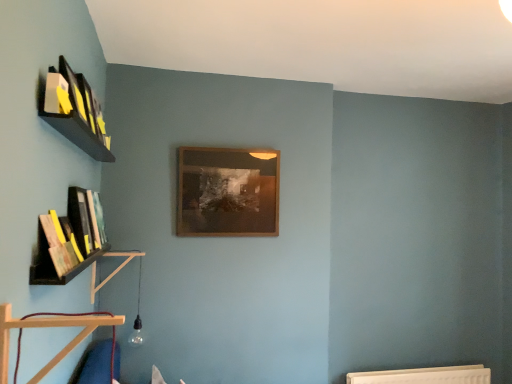
Where is `wooden picture frame at center`? The width and height of the screenshot is (512, 384). wooden picture frame at center is located at coordinates (228, 192).

This screenshot has height=384, width=512. In order to click on wooden at lower left, which is counted as the 2th shelf, starting from the back in this screenshot , I will do `click(47, 326)`.

What is the approximate width of hardcover book at left, acting as the 2th book starting from the back?

hardcover book at left, acting as the 2th book starting from the back, is 8.23 centimeters wide.

This screenshot has width=512, height=384. Find the location of `wooden picture frame at center`. wooden picture frame at center is located at coordinates (228, 192).

Based on the photo, is wooden at left, the first shelf in the back-to-front sequence, further to camera compared to matte yellow book at upper left, the third book in the left-to-right sequence?

Yes, the depth of wooden at left, the first shelf in the back-to-front sequence, is greater than that of matte yellow book at upper left, the third book in the left-to-right sequence.

Find the location of a particular element. Image resolution: width=512 pixels, height=384 pixels. book that is the 3rd one above the wooden at left, the second shelf in the right-to-left sequence (from a real-world perspective) is located at coordinates (57, 95).

In terms of size, does wooden at left, arranged as the second shelf when viewed from the front, appear bigger or smaller than matte yellow book at upper left, which is the third book from back to front?

wooden at left, arranged as the second shelf when viewed from the front, is bigger than matte yellow book at upper left, which is the third book from back to front.

Consider the image. Measure the distance between wooden at left, arranged as the first shelf when viewed from the left, and matte yellow book at upper left, placed as the 3th book when sorted from bottom to top.

wooden at left, arranged as the first shelf when viewed from the left, is 1.21 meters from matte yellow book at upper left, placed as the 3th book when sorted from bottom to top.

Is wooden picture frame at center far from wooden at lower left, the 2th shelf positioned from the left?

Yes, wooden picture frame at center is far from wooden at lower left, the 2th shelf positioned from the left.

I want to click on the 1st shelf below the wooden picture frame at center (from the image's perspective), so click(47, 326).

In terms of height, does wooden picture frame at center look taller or shorter compared to wooden at lower left, the 2th shelf positioned from the left?

wooden picture frame at center is taller than wooden at lower left, the 2th shelf positioned from the left.

Considering the positions of points (213, 221) and (16, 319), is point (213, 221) farther from camera compared to point (16, 319)?

Yes, point (213, 221) is farther from viewer.

From a real-world perspective, is hardcover book at left, the second book from the top, beneath wooden at left, arranged as the first shelf when viewed from the left?

No, from a real-world perspective, hardcover book at left, the second book from the top, is not under wooden at left, arranged as the first shelf when viewed from the left.

From the image's perspective, is hardcover book at left, acting as the 2th book starting from the back, located above wooden at left, the second shelf in the right-to-left sequence?

Yes, from the image's perspective, hardcover book at left, acting as the 2th book starting from the back, is on top of wooden at left, the second shelf in the right-to-left sequence.

Who is taller, hardcover book at left, the 2th book in the left-to-right sequence, or wooden at left, the second shelf in the right-to-left sequence?

With more height is wooden at left, the second shelf in the right-to-left sequence.

From a real-world perspective, who is located higher, wooden at lower left, acting as the first shelf starting from the front, or matte yellow book at upper left, which ranks as the first book in right-to-left order?

matte yellow book at upper left, which ranks as the first book in right-to-left order, from a real-world perspective.

Between wooden at lower left, acting as the first shelf starting from the front, and matte yellow book at upper left, placed as the first book when sorted from top to bottom, which one appears on the left side from the viewer's perspective?

From the viewer's perspective, matte yellow book at upper left, placed as the first book when sorted from top to bottom, appears more on the left side.

Between wooden at lower left, the 2th shelf positioned from the left, and matte yellow book at upper left, placed as the 3th book when sorted from bottom to top, which one is positioned behind?

Positioned behind is matte yellow book at upper left, placed as the 3th book when sorted from bottom to top.

Could you tell me if wooden at lower left, the 2th shelf positioned from the left, is turned towards matte yellow book at upper left, placed as the 3th book when sorted from bottom to top?

No, wooden at lower left, the 2th shelf positioned from the left, is not aimed at matte yellow book at upper left, placed as the 3th book when sorted from bottom to top.

Considering the relative sizes of hardcover book at left, which ranks as the first book in left-to-right order, and wooden at left, arranged as the first shelf when viewed from the left, in the image provided, is hardcover book at left, which ranks as the first book in left-to-right order, smaller than wooden at left, arranged as the first shelf when viewed from the left,?

Indeed, hardcover book at left, which ranks as the first book in left-to-right order, has a smaller size compared to wooden at left, arranged as the first shelf when viewed from the left.

Is hardcover book at left, arranged as the third book when viewed from the right, not within wooden at left, the first shelf in the back-to-front sequence?

hardcover book at left, arranged as the third book when viewed from the right, lies outside wooden at left, the first shelf in the back-to-front sequence,'s area.

Is hardcover book at left, which ranks as the first book in left-to-right order, in front of or behind wooden at left, the first shelf in the back-to-front sequence, in the image?

Visually, hardcover book at left, which ranks as the first book in left-to-right order, is located in front of wooden at left, the first shelf in the back-to-front sequence.

From the picture: Is hardcover book at left, which ranks as the first book in left-to-right order, thinner than wooden at left, the first shelf in the back-to-front sequence?

Correct, the width of hardcover book at left, which ranks as the first book in left-to-right order, is less than that of wooden at left, the first shelf in the back-to-front sequence.

Is matte yellow book at upper left, which is the third book from back to front, next to wooden picture frame at center and touching it?

No, matte yellow book at upper left, which is the third book from back to front, is not with wooden picture frame at center.

Which is in front, point (45, 98) or point (231, 150)?

The point (45, 98) is closer.

Is matte yellow book at upper left, which ranks as the first book in right-to-left order, facing away from wooden picture frame at center?

No, matte yellow book at upper left, which ranks as the first book in right-to-left order, is not facing away from wooden picture frame at center.

Between matte yellow book at upper left, placed as the first book when sorted from top to bottom, and wooden picture frame at center, which one has less height?

matte yellow book at upper left, placed as the first book when sorted from top to bottom.

From the image's perspective, which book is the 1st one below the matte yellow book at upper left, the third book in the left-to-right sequence? Please provide its 2D coordinates.

[(86, 219)]

Between hardcover book at left, acting as the 2th book starting from the back, and matte yellow book at upper left, placed as the 1th book when sorted from front to back, which one is positioned behind?

hardcover book at left, acting as the 2th book starting from the back, is behind.

From the image's perspective, relative to matte yellow book at upper left, placed as the 3th book when sorted from bottom to top, is hardcover book at left, which ranks as the 2th book in front-to-back order, above or below?

Based on their image positions, hardcover book at left, which ranks as the 2th book in front-to-back order, is located beneath matte yellow book at upper left, placed as the 3th book when sorted from bottom to top.

Is hardcover book at left, the second book from the top, far from matte yellow book at upper left, which is the third book from back to front?

No, hardcover book at left, the second book from the top, is not far from matte yellow book at upper left, which is the third book from back to front.

In order to click on the 2nd shelf below the matte yellow book at upper left, placed as the 1th book when sorted from front to back (from the image's perspective) in this screenshot , I will do `click(113, 271)`.

At what (x,y) coordinates should I click in order to perform the action: click on picture frame located on the right of wooden at lower left, which is counted as the 2th shelf, starting from the back. Please return your answer as a coordinate pair (x, y). The image size is (512, 384). Looking at the image, I should click on (228, 192).

Which object lies nearer to the anchor point hardcover book at left, which appears as the 3th book when viewed from the front, wooden at lower left, acting as the first shelf starting from the front, or wooden at left, arranged as the second shelf when viewed from the front?

wooden at left, arranged as the second shelf when viewed from the front, is closer to hardcover book at left, which appears as the 3th book when viewed from the front.

Considering their positions, is hardcover book at left, arranged as the third book when viewed from the right, positioned closer to matte yellow book at upper left, the third book in the left-to-right sequence, than wooden at lower left, acting as the first shelf starting from the front?

wooden at lower left, acting as the first shelf starting from the front, lies closer to matte yellow book at upper left, the third book in the left-to-right sequence, than the other object.

Looking at the image, which one is located closer to wooden at lower left, marked as the first shelf in a right-to-left arrangement, hardcover book at left, arranged as the third book when viewed from the right, or wooden at left, arranged as the second shelf when viewed from the front?

Based on the image, hardcover book at left, arranged as the third book when viewed from the right, appears to be nearer to wooden at lower left, marked as the first shelf in a right-to-left arrangement.

Looking at the image, which one is located closer to wooden at left, the second shelf in the right-to-left sequence, wooden at lower left, acting as the first shelf starting from the front, or wooden picture frame at center?

The object closer to wooden at left, the second shelf in the right-to-left sequence, is wooden picture frame at center.

Considering their positions, is hardcover book at left, which appears as the 3th book when viewed from the front, positioned closer to matte yellow book at upper left, placed as the 1th book when sorted from front to back, than wooden picture frame at center?

hardcover book at left, which appears as the 3th book when viewed from the front, is positioned closer to the anchor matte yellow book at upper left, placed as the 1th book when sorted from front to back.

When comparing their distances from wooden at left, the second shelf in the right-to-left sequence, does hardcover book at left, the 2th book in the left-to-right sequence, or wooden at lower left, the 2th shelf positioned from the left, seem further?

wooden at lower left, the 2th shelf positioned from the left, is positioned further to the anchor wooden at left, the second shelf in the right-to-left sequence.

Looking at the image, which one is located closer to matte yellow book at upper left, the third book in the left-to-right sequence, hardcover book at left, acting as the 1th book starting from the back, or hardcover book at left, the 2th book in the left-to-right sequence?

hardcover book at left, the 2th book in the left-to-right sequence, is positioned closer to the anchor matte yellow book at upper left, the third book in the left-to-right sequence.

When comparing their distances from wooden at lower left, which is counted as the 2th shelf, starting from the back, does wooden picture frame at center or hardcover book at left, arranged as the third book when viewed from the right, seem closer?

Based on the image, hardcover book at left, arranged as the third book when viewed from the right, appears to be nearer to wooden at lower left, which is counted as the 2th shelf, starting from the back.

At what (x,y) coordinates should I click in order to perform the action: click on book between hardcover book at left, acting as the 2th book starting from the back, and wooden picture frame at center from front to back. Please return your answer as a coordinate pair (x, y). The width and height of the screenshot is (512, 384). Looking at the image, I should click on (96, 219).

This screenshot has width=512, height=384. I want to click on shelf between matte yellow book at upper left, which is the third book from back to front, and wooden picture frame at center, along the z-axis, so click(113, 271).

Find the location of a particular element. Image resolution: width=512 pixels, height=384 pixels. book between wooden at lower left, which is counted as the 2th shelf, starting from the back, and hardcover book at left, the 2th book ordered from the bottom, along the z-axis is located at coordinates (57, 95).

Find the location of a particular element. This screenshot has height=384, width=512. shelf between hardcover book at left, the second book from the top, and wooden picture frame at center, along the z-axis is located at coordinates (113, 271).